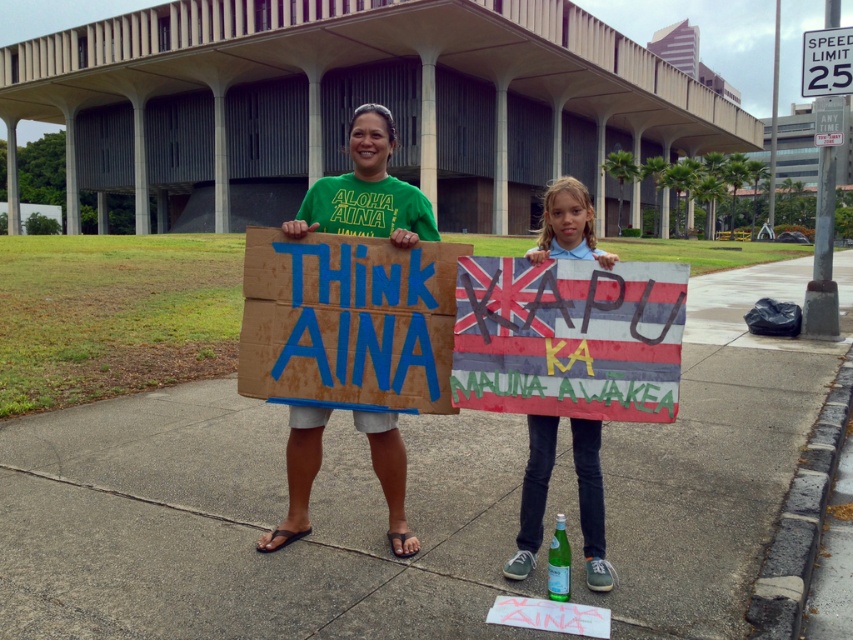
You are a photographer trying to capture a clear shot of the white cotton shirt at center without the cardboard sign at center blocking it. What adjustment should you make to your camera angle?

The cardboard sign at center is positioned over the white cotton shirt at center, so tilting the camera slightly downward would lower the angle and avoid the sign blocking the shirt.

From the picture: You are a photographer trying to capture a photo of the brown concrete pavement at center and the cardboard sign at center. Which object is taller in the image?

The brown concrete pavement at center is taller than the cardboard sign at center.

You are a delivery drone flying over the sidewalk where the two protesters are standing. You need to land at the point marked by the coordinates point [247,524]. Where should you land?

The point [247,524] is on the brown concrete pavement at center, so you should land on the brown concrete pavement at center.